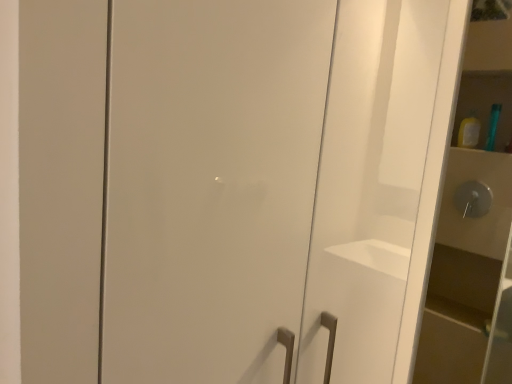
Question: Considering the positions of matte white cabinet at right and glossy white cabinet at center in the image, is matte white cabinet at right wider or thinner than glossy white cabinet at center?

Choices:
 (A) thin
 (B) wide

Answer: (A)

Question: From the image's perspective, is matte white cabinet at right positioned above or below glossy white cabinet at center?

Choices:
 (A) below
 (B) above

Answer: (A)

Question: Which is nearer to the green plastic toothbrush at upper right?

Choices:
 (A) glossy white cabinet at center
 (B) matte white cabinet at right

Answer: (B)

Question: Estimate the real-world distances between objects in this image. Which object is farther from the matte white cabinet at right?

Choices:
 (A) green plastic toothbrush at upper right
 (B) glossy white cabinet at center

Answer: (B)